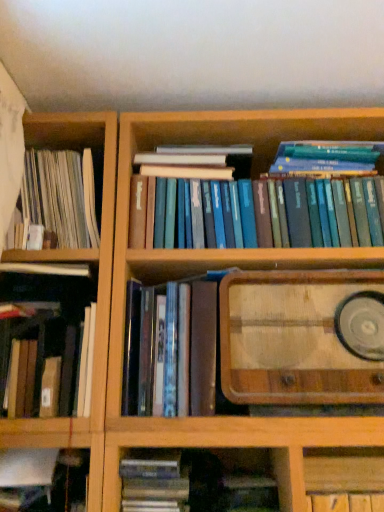
Looking at this image, measure the distance between point (331,328) and camera.

Point (331,328) is 1.01 meters from camera.

This screenshot has width=384, height=512. Describe the element at coordinates (269, 203) in the screenshot. I see `blue hardcover books at upper center, which is the sixth book in left-to-right order` at that location.

You are a GUI agent. You are given a task and a screenshot of the screen. Output one action in this format:
    pyautogui.click(x=<x>, y=<y>)
    Task: Click on the matte plastic books at center, marked as the second book in a right-to-left arrangement
    
    Given the screenshot: What is the action you would take?
    pyautogui.click(x=171, y=350)

Locate an element on the screen. Image resolution: width=384 pixels, height=512 pixels. hardcover book at center, positioned as the third book in right-to-left order is located at coordinates (154, 480).

The width and height of the screenshot is (384, 512). Describe the element at coordinates (154, 480) in the screenshot. I see `hardcover book at center, the 4th book when ordered from left to right` at that location.

What are the coordinates of `hardcover book at left, the third book when ordered from left to right` in the screenshot? It's located at (46, 338).

Where is `white paperbacks at left, the first book in the left-to-right sequence`? The image size is (384, 512). white paperbacks at left, the first book in the left-to-right sequence is located at coordinates (61, 196).

Which object is positioned more to the left, hardcover book at left, the third book when ordered from left to right, or white paperbacks at left, which is counted as the sixth book, starting from the right?

white paperbacks at left, which is counted as the sixth book, starting from the right, is more to the left.

Which object is wider, hardcover book at left, the third book when ordered from left to right, or white paperbacks at left, the first book in the left-to-right sequence?

hardcover book at left, the third book when ordered from left to right.

Identify the location of book that is the 3rd object located above the hardcover book at left, the third book when ordered from left to right (from the image's perspective). pyautogui.click(x=61, y=196).

Looking at this image, which is closer to the camera, (x=15, y=324) or (x=68, y=186)?

Point (x=15, y=324)

Is point (160, 477) closer or farther from the camera than point (32, 191)?

Point (160, 477).

From a real-world perspective, which is physically above, hardcover book at center, the 4th book when ordered from left to right, or white paperbacks at left, the first book in the left-to-right sequence?

white paperbacks at left, the first book in the left-to-right sequence, is physically above.

Based on the photo, considering the relative sizes of hardcover book at center, the 4th book when ordered from left to right, and white paperbacks at left, which is counted as the sixth book, starting from the right, in the image provided, is hardcover book at center, the 4th book when ordered from left to right, thinner than white paperbacks at left, which is counted as the sixth book, starting from the right,?

No, hardcover book at center, the 4th book when ordered from left to right, is not thinner than white paperbacks at left, which is counted as the sixth book, starting from the right.

Does wooden radio at center-right have a larger size compared to blue hardcover books at upper center, which is the sixth book in left-to-right order?

Yes, wooden radio at center-right is bigger than blue hardcover books at upper center, which is the sixth book in left-to-right order.

From the image's perspective, is wooden radio at center-right located above or below blue hardcover books at upper center, which is the sixth book in left-to-right order?

wooden radio at center-right is below blue hardcover books at upper center, which is the sixth book in left-to-right order.

Considering the sizes of objects wooden radio at center-right and blue hardcover books at upper center, which is the first book from right to left, in the image provided, who is taller, wooden radio at center-right or blue hardcover books at upper center, which is the first book from right to left,?

wooden radio at center-right.

Is wooden radio at center-right at the left side of blue hardcover books at upper center, which is the sixth book in left-to-right order?

Incorrect, wooden radio at center-right is not on the left side of blue hardcover books at upper center, which is the sixth book in left-to-right order.

Is point (366, 382) positioned after point (39, 483)?

No, it is not.

Is wooden radio at center-right oriented towards hardcover book at lower left, the fifth book positioned from the right?

No, wooden radio at center-right is not aimed at hardcover book at lower left, the fifth book positioned from the right.

Is wooden radio at center-right thinner than hardcover book at lower left, the fifth book positioned from the right?

Incorrect, the width of wooden radio at center-right is not less than that of hardcover book at lower left, the fifth book positioned from the right.

Looking at this image, how different are the orientations of wooden radio at center-right and hardcover book at lower left, marked as the 2th book in a left-to-right arrangement, in degrees?

The facing directions of wooden radio at center-right and hardcover book at lower left, marked as the 2th book in a left-to-right arrangement, are 0.000681 degrees apart.

Does matte plastic books at center, positioned as the fifth book in left-to-right order, have a larger size compared to hardcover book at left, which is counted as the 4th book, starting from the right?

No.

Between matte plastic books at center, positioned as the fifth book in left-to-right order, and hardcover book at left, which is counted as the 4th book, starting from the right, which one has smaller width?

With smaller width is hardcover book at left, which is counted as the 4th book, starting from the right.

Consider the image. Is matte plastic books at center, marked as the second book in a right-to-left arrangement, facing towards hardcover book at left, the third book when ordered from left to right?

No.

Locate an element on the screen. This screenshot has width=384, height=512. the 1st book positioned above the hardcover book at left, the third book when ordered from left to right (from the image's perspective) is located at coordinates (171, 350).

Considering the relative sizes of white paperbacks at left, which is counted as the sixth book, starting from the right, and wooden radio at center-right in the image provided, is white paperbacks at left, which is counted as the sixth book, starting from the right, thinner than wooden radio at center-right?

Correct, the width of white paperbacks at left, which is counted as the sixth book, starting from the right, is less than that of wooden radio at center-right.

From the image's perspective, is white paperbacks at left, which is counted as the sixth book, starting from the right, positioned above or below wooden radio at center-right?

From the image's perspective, white paperbacks at left, which is counted as the sixth book, starting from the right, appears above wooden radio at center-right.

Which is more to the right, white paperbacks at left, which is counted as the sixth book, starting from the right, or wooden radio at center-right?

wooden radio at center-right is more to the right.

Is white paperbacks at left, the first book in the left-to-right sequence, far from wooden radio at center-right?

No, white paperbacks at left, the first book in the left-to-right sequence, is in close proximity to wooden radio at center-right.

Based on their sizes in the image, would you say hardcover book at left, which is counted as the 4th book, starting from the right, is bigger or smaller than hardcover book at center, positioned as the third book in right-to-left order?

hardcover book at left, which is counted as the 4th book, starting from the right, is bigger than hardcover book at center, positioned as the third book in right-to-left order.

Which object is wider, hardcover book at left, the third book when ordered from left to right, or hardcover book at center, positioned as the third book in right-to-left order?

With larger width is hardcover book at center, positioned as the third book in right-to-left order.

Considering the positions of objects hardcover book at left, the third book when ordered from left to right, and hardcover book at center, the 4th book when ordered from left to right, in the image provided, who is more to the right, hardcover book at left, the third book when ordered from left to right, or hardcover book at center, the 4th book when ordered from left to right,?

From the viewer's perspective, hardcover book at center, the 4th book when ordered from left to right, appears more on the right side.

At what (x,y) coordinates should I click in order to perform the action: click on the 2nd book to the right when counting from the white paperbacks at left, the first book in the left-to-right sequence. Please return your answer as a coordinate pair (x, y). Looking at the image, I should click on (46, 338).

From a real-world perspective, count 5th books upward from the hardcover book at center, the 4th book when ordered from left to right, and point to it. Please provide its 2D coordinates.

[(61, 196)]

Estimate the real-world distances between objects in this image. Which object is further from blue hardcover books at upper center, which is the sixth book in left-to-right order, hardcover book at lower left, marked as the 2th book in a left-to-right arrangement, or white paperbacks at left, the first book in the left-to-right sequence?

hardcover book at lower left, marked as the 2th book in a left-to-right arrangement, is further to blue hardcover books at upper center, which is the sixth book in left-to-right order.

Which object lies nearer to the anchor point hardcover book at left, the third book when ordered from left to right, matte plastic books at center, marked as the second book in a right-to-left arrangement, or blue hardcover books at upper center, which is the sixth book in left-to-right order?

matte plastic books at center, marked as the second book in a right-to-left arrangement, lies closer to hardcover book at left, the third book when ordered from left to right, than the other object.

Which object lies further to the anchor point matte plastic books at center, marked as the second book in a right-to-left arrangement, wooden cabinet at lower right or hardcover book at center, positioned as the third book in right-to-left order?

Based on the image, wooden cabinet at lower right appears to be further to matte plastic books at center, marked as the second book in a right-to-left arrangement.

Based on their spatial positions, is white paperbacks at left, which is counted as the sixth book, starting from the right, or wooden radio at center-right closer to hardcover book at center, the 4th book when ordered from left to right?

Based on the image, wooden radio at center-right appears to be nearer to hardcover book at center, the 4th book when ordered from left to right.

Which object lies further to the anchor point hardcover book at center, the 4th book when ordered from left to right, wooden radio at center-right or wooden cabinet at lower right?

The object further to hardcover book at center, the 4th book when ordered from left to right, is wooden radio at center-right.

When comparing their distances from white paperbacks at left, which is counted as the sixth book, starting from the right, does matte plastic books at center, marked as the second book in a right-to-left arrangement, or hardcover book at left, which is counted as the 4th book, starting from the right, seem further?

matte plastic books at center, marked as the second book in a right-to-left arrangement, is further to white paperbacks at left, which is counted as the sixth book, starting from the right.

When comparing their distances from wooden radio at center-right, does wooden cabinet at lower right or hardcover book at lower left, marked as the 2th book in a left-to-right arrangement, seem further?

Based on the image, hardcover book at lower left, marked as the 2th book in a left-to-right arrangement, appears to be further to wooden radio at center-right.

Based on the photo, which object lies nearer to the anchor point wooden radio at center-right, hardcover book at lower left, the fifth book positioned from the right, or matte plastic books at center, positioned as the fifth book in left-to-right order?

matte plastic books at center, positioned as the fifth book in left-to-right order, is closer to wooden radio at center-right.

The image size is (384, 512). I want to click on book cover between blue hardcover books at upper center, which is the sixth book in left-to-right order, and wooden cabinet at lower right in the up-down direction, so click(x=293, y=339).

This screenshot has width=384, height=512. Find the location of `book between matte plastic books at center, marked as the second book in a right-to-left arrangement, and wooden radio at center-right, in the horizontal direction`. book between matte plastic books at center, marked as the second book in a right-to-left arrangement, and wooden radio at center-right, in the horizontal direction is located at coordinates (269, 203).

Image resolution: width=384 pixels, height=512 pixels. What are the coordinates of `book cover located between hardcover book at left, which is counted as the 4th book, starting from the right, and wooden cabinet at lower right in the left-right direction` in the screenshot? It's located at (293, 339).

The width and height of the screenshot is (384, 512). In order to click on book cover between hardcover book at center, positioned as the third book in right-to-left order, and wooden cabinet at lower right from left to right in this screenshot , I will do `click(293, 339)`.